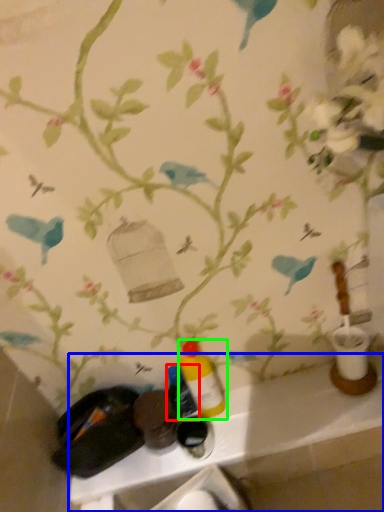
Question: Estimate the real-world distances between objects in this image. Which object is closer to bottle (highlighted by a red box), counter (highlighted by a blue box) or bottle (highlighted by a green box)?

Choices:
 (A) counter
 (B) bottle

Answer: (B)